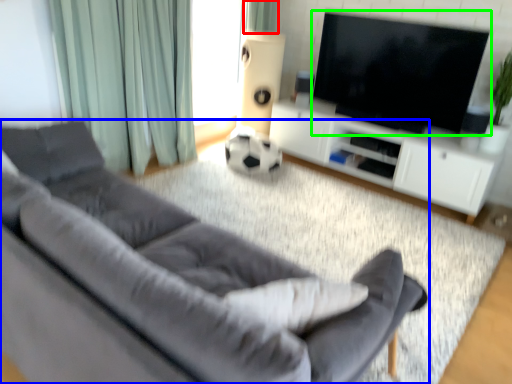
Question: Estimate the real-world distances between objects in this image. Which object is closer to curtain (highlighted by a red box), studio couch (highlighted by a blue box) or television (highlighted by a green box)?

Choices:
 (A) studio couch
 (B) television

Answer: (B)